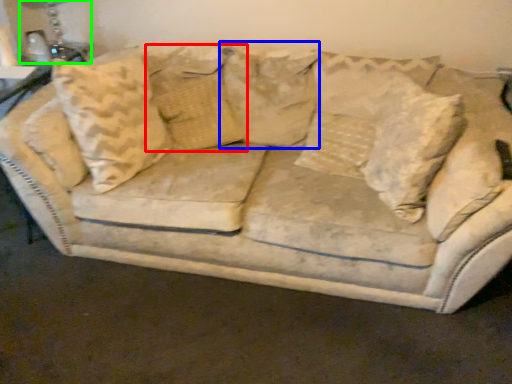
Question: Which is nearer to the pillow (highlighted by a red box)? pillow (highlighted by a blue box) or table lamp (highlighted by a green box).

Choices:
 (A) pillow
 (B) table lamp

Answer: (A)